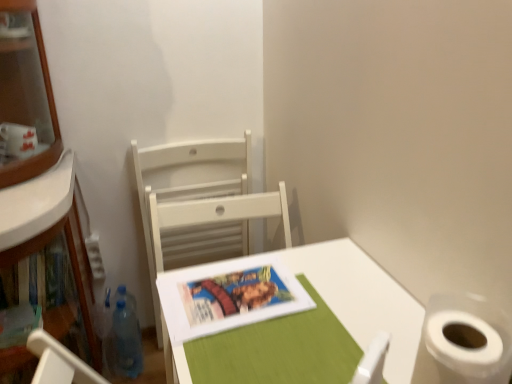
Find the location of a particular element. The height and width of the screenshot is (384, 512). free point in front of matte paper book cover at center is located at coordinates (255, 353).